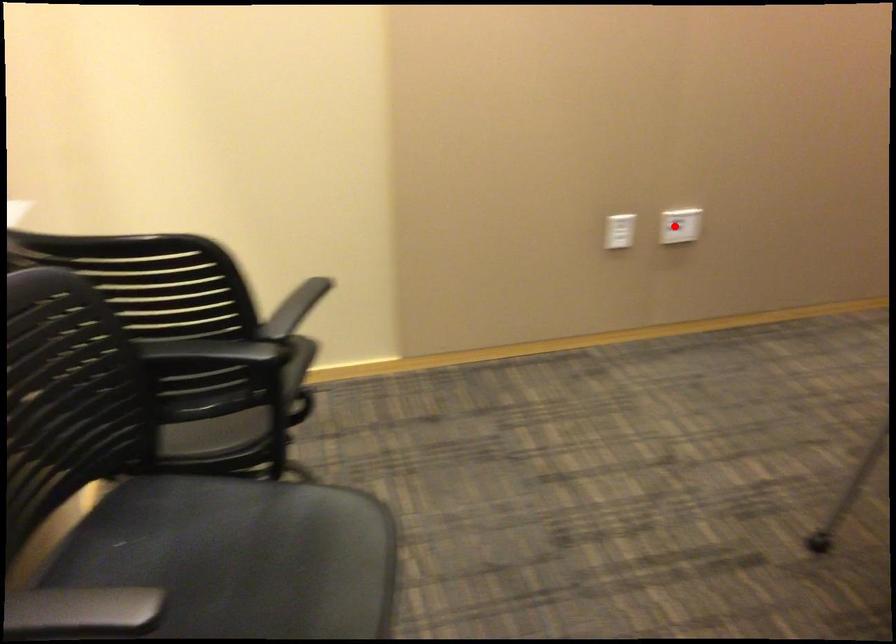
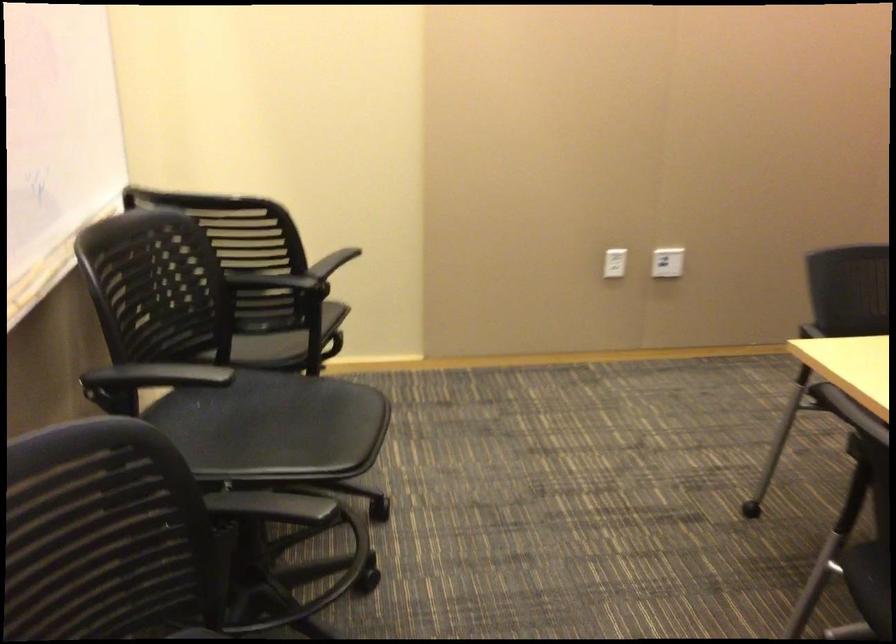
Question: A red point is marked in image1. In image2, is the corresponding 3D point closer to the camera or farther? Reply with the corresponding letter.

Choices:
 (A) The corresponding 3D point is closer.
 (B) The corresponding 3D point is farther.

Answer: (B)